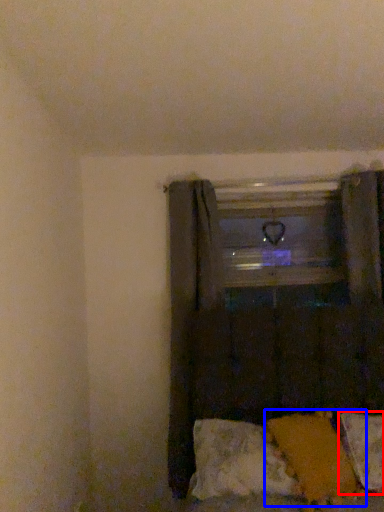
Question: Which object appears closest to the camera in this image, pillow (highlighted by a red box) or pillow (highlighted by a blue box)?

Choices:
 (A) pillow
 (B) pillow

Answer: (B)